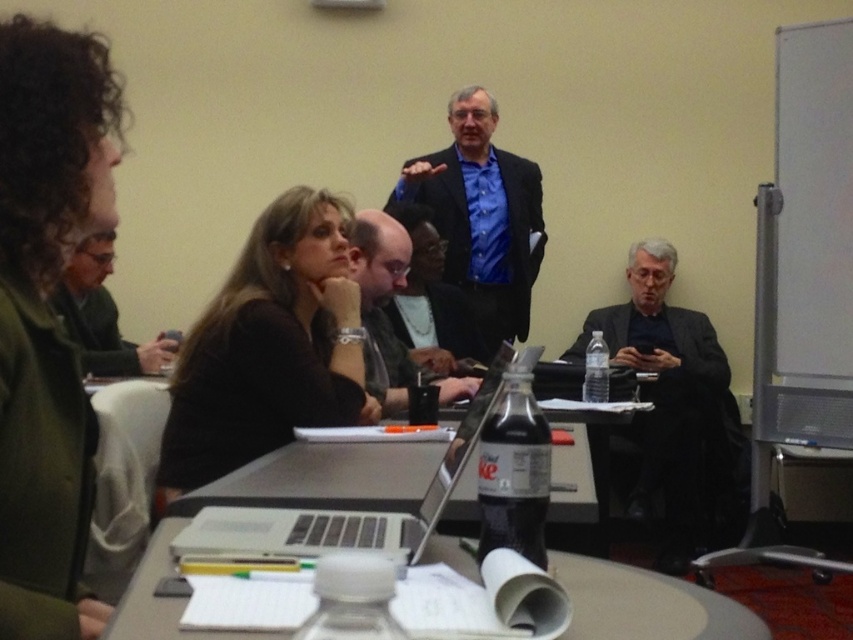
You are a photographer standing in front of the table. You want to take a photo of the silver metallic laptop at center without any obstruction. Is the black matte shirt at center blocking your view of the laptop?

The silver metallic laptop at center is behind the black matte shirt at center, so the shirt is blocking the view of the laptop. To take a photo of the laptop without obstruction, you would need to move the shirt or adjust your angle so that the shirt is not in front of the laptop.

You are a photographer taking a picture of the silver metallic laptop at center. To ensure the black matte shirt at center doesn not block the view, where should you position the camera relative to the laptop?

The black matte shirt at center is located above the silver metallic laptop at center. To avoid blocking the view, position the camera below the laptop so that the shirt is out of frame or angled downward to capture the laptop without obstruction.

You are a photographer setting up for a professional photoshoot in this room. You need to position a 1.5m tall tripod between the black matte suit at right and the clear plastic bottle at center. Will the tripod fit vertically between them without touching either object?

The black matte suit at right is taller than the clear plastic bottle at center. Since the tripod is 1.5m tall, it may not fit vertically between them if the height difference between the two objects is significant. However, the exact vertical clearance isn not specified in the objects description, so we cannot definitively determine if the tripod will fit without additional information.